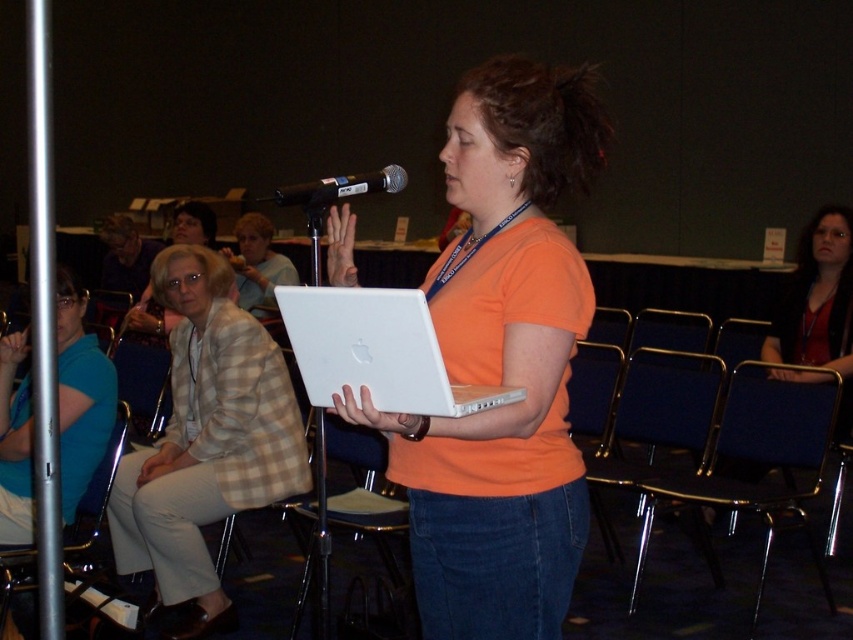
Question: Among these points, which one is nearest to the camera?

Choices:
 (A) (281, 198)
 (B) (148, 417)
 (C) (289, 388)

Answer: (A)

Question: Can you confirm if blue fabric chair at lower right is wider than plaid fabric jacket at upper left?

Choices:
 (A) yes
 (B) no

Answer: (A)

Question: Where is plaid fabric jacket at left located in relation to plastic chair at lower left in the image?

Choices:
 (A) above
 (B) below

Answer: (B)

Question: Which point is farther to the camera?

Choices:
 (A) (277, 397)
 (B) (161, 342)
 (C) (653, 436)
 (D) (450, 330)

Answer: (B)

Question: Which object is positioned farthest from the blue fabric chair at lower right?

Choices:
 (A) light beige plaid blazer at upper left
 (B) metallic blue chair at lower left
 (C) white plastic laptop at center

Answer: (A)

Question: Does white plastic laptop at center have a greater width compared to black plastic microphone at center?

Choices:
 (A) no
 (B) yes

Answer: (B)